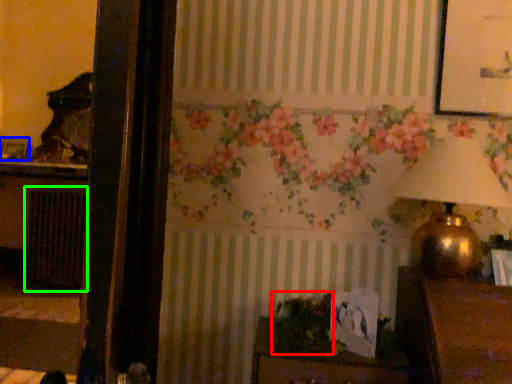
Question: Based on their relative distances, which object is farther from plant (highlighted by a red box)? Choose from picture frame (highlighted by a blue box) and radiator (highlighted by a green box).

Choices:
 (A) picture frame
 (B) radiator

Answer: (A)